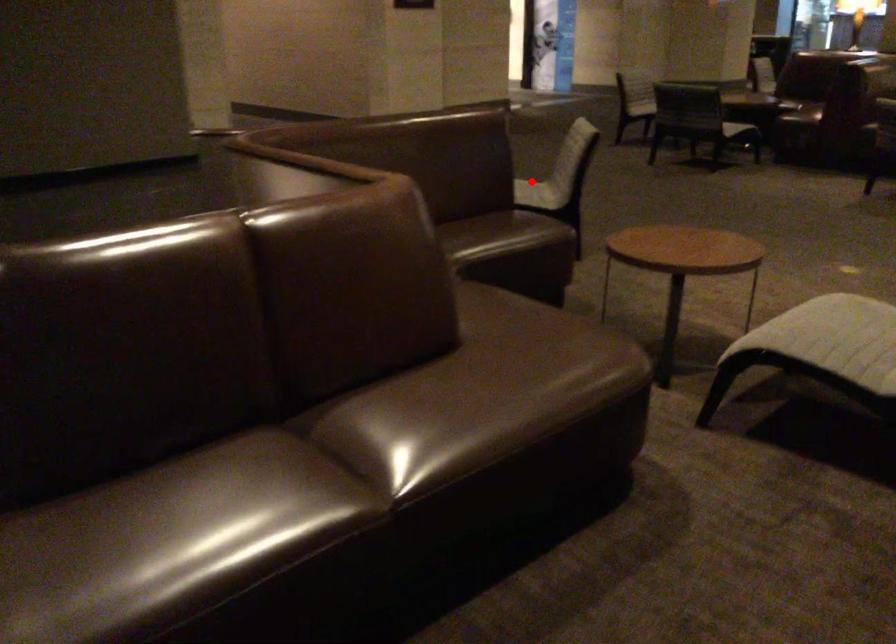
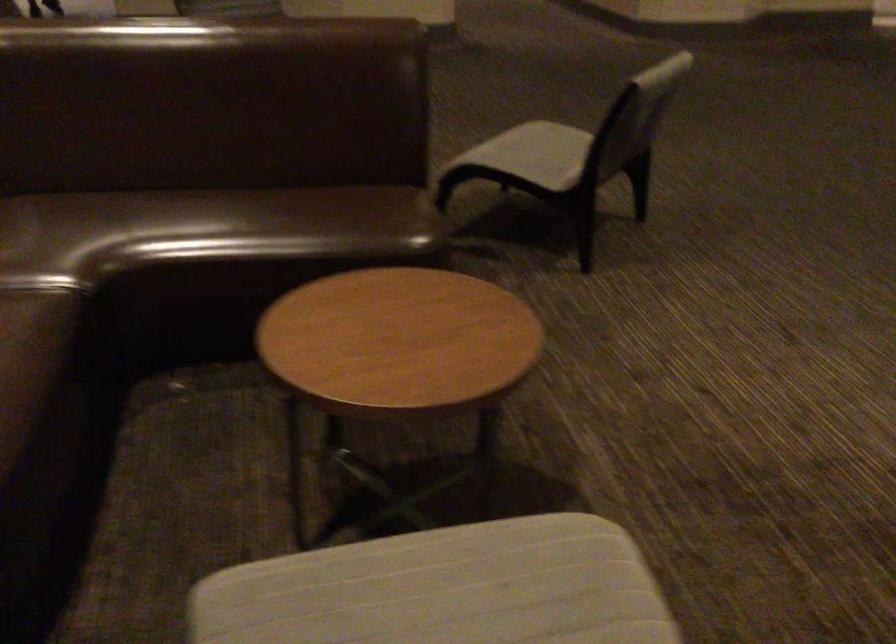
Question: I am providing you with two images of the same scene from different viewpoints. Image1 has a red point marked. In image2, the corresponding 3D location appears at what relative position? Reply with the corresponding letter.

Choices:
 (A) Closer
 (B) Farther

Answer: (A)